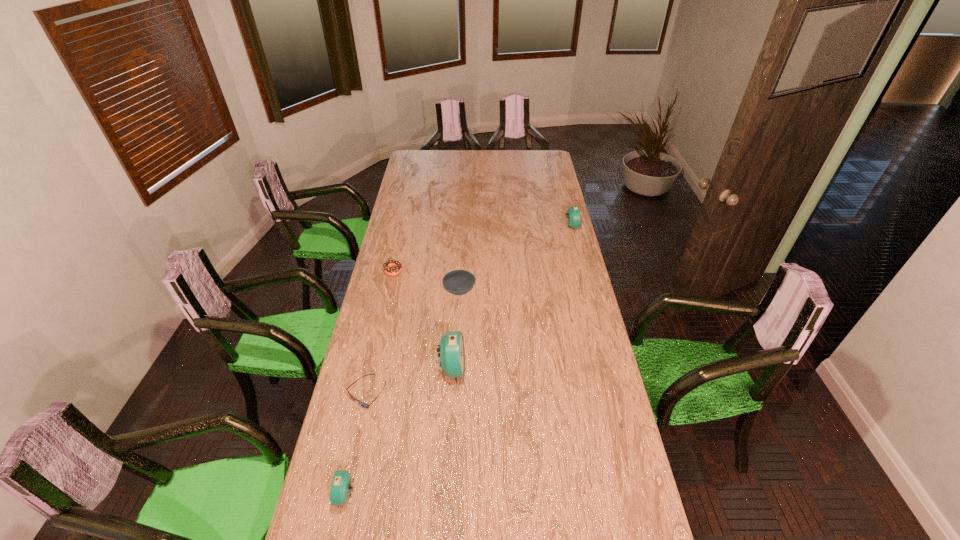
Please point a spot to place another alarm_clock for symmetrical spacing. Please provide its 2D coordinates. Your answer should be formatted as a tuple, i.e. [(x, y)], where the tuple contains the x and y coordinates of a point satisfying the conditions above.

[(521, 286)]